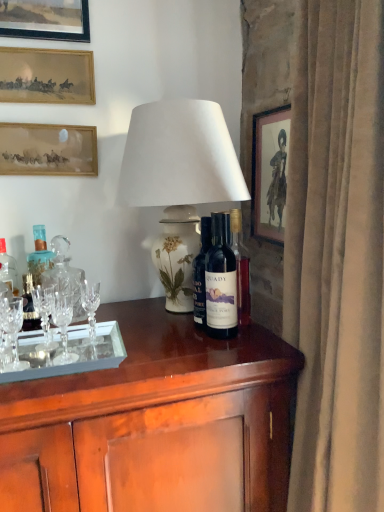
Question: Can you confirm if clear crystal wine glass at left is smaller than dark blue glass bottle at center?

Choices:
 (A) yes
 (B) no

Answer: (A)

Question: Is clear crystal wine glass at left to the right of dark blue glass bottle at center from the viewer's perspective?

Choices:
 (A) yes
 (B) no

Answer: (B)

Question: Considering the relative positions of clear crystal wine glass at left and dark blue glass bottle at center in the image provided, is clear crystal wine glass at left to the left of dark blue glass bottle at center from the viewer's perspective?

Choices:
 (A) yes
 (B) no

Answer: (A)

Question: Is clear crystal wine glass at left next to dark blue glass bottle at center?

Choices:
 (A) no
 (B) yes

Answer: (A)

Question: Is clear crystal wine glass at left taller than dark blue glass bottle at center?

Choices:
 (A) yes
 (B) no

Answer: (B)

Question: Can you confirm if clear crystal wine glass at left is wider than dark blue glass bottle at center?

Choices:
 (A) yes
 (B) no

Answer: (B)

Question: Is white ceramic lamp at center taller than wooden picture frame at upper left, the first picture frame in the left-to-right sequence?

Choices:
 (A) no
 (B) yes

Answer: (B)

Question: Could you tell me if white ceramic lamp at center is facing wooden picture frame at upper left, which appears as the 1th picture frame when viewed from the top?

Choices:
 (A) no
 (B) yes

Answer: (A)

Question: Are white ceramic lamp at center and wooden picture frame at upper left, the first picture frame in the left-to-right sequence, far apart?

Choices:
 (A) yes
 (B) no

Answer: (B)

Question: Is the position of white ceramic lamp at center more distant than that of wooden picture frame at upper left, the first picture frame in the left-to-right sequence?

Choices:
 (A) yes
 (B) no

Answer: (B)

Question: From the image's perspective, is white ceramic lamp at center beneath wooden picture frame at upper left, which appears as the 1th picture frame when viewed from the top?

Choices:
 (A) no
 (B) yes

Answer: (B)

Question: Does white ceramic lamp at center appear on the left side of wooden picture frame at upper left, acting as the fourth picture frame starting from the right?

Choices:
 (A) no
 (B) yes

Answer: (A)

Question: Is white ceramic lamp at center thinner than dark blue glass bottle at center, which appears as the 1th bottle when viewed from the right?

Choices:
 (A) no
 (B) yes

Answer: (A)